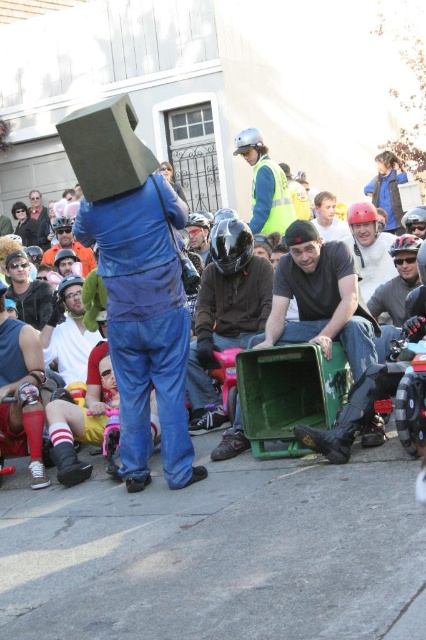
Question: Is gray concrete pavement at lower center behind reflective yellow vest at upper center?

Choices:
 (A) no
 (B) yes

Answer: (A)

Question: Which point is farther to the camera?

Choices:
 (A) gray concrete pavement at lower center
 (B) reflective yellow vest at upper center
 (C) matte blue jumpsuit at center
 (D) red socked leg at lower left

Answer: (B)

Question: Does gray concrete pavement at lower center appear on the left side of reflective yellow vest at upper center?

Choices:
 (A) yes
 (B) no

Answer: (A)

Question: Which object appears farthest from the camera in this image?

Choices:
 (A) reflective yellow vest at upper center
 (B) red socked leg at lower left
 (C) gray concrete pavement at lower center

Answer: (A)

Question: Which of these objects is positioned farthest from the matte blue jumpsuit at center?

Choices:
 (A) reflective yellow vest at upper center
 (B) red socked leg at lower left

Answer: (A)

Question: Is the position of matte blue jumpsuit at center less distant than that of reflective yellow vest at upper center?

Choices:
 (A) yes
 (B) no

Answer: (A)